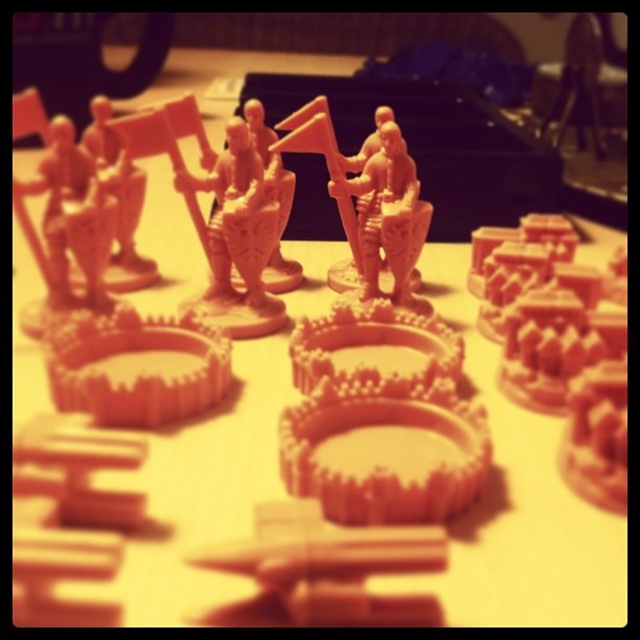
You are a photographer standing at a distance of 30 inches from the scene of miniature figurines. You want to capture a closeup shot of the point at coordinates point (138, 413). Do you need to move closer or farther away to focus on that point?

The distance of point (138, 413) from viewer is 33.13 inches, so you are currently 30 inches away. To focus on the point, you need to move closer by 3.13 inches.

You are a collector organizing miniature figurines on a display shelf. You have two gears, the matte plastic gear at center and the matte orange gear at center. Which gear is closer to you when you look at the display?

The matte plastic gear at center is closer to you because it is in front of the matte orange gear at center.

You are a collector who wants to display the matte plastic gear at center on a shelf that is 50 centimeters away from the wall. Will the gear fit on the shelf without touching the wall?

The matte plastic gear at center is 53.40 centimeters away from the viewer, so it will not fit on the shelf that is only 50 centimeters away from the wall, as it extends beyond the shelf space.